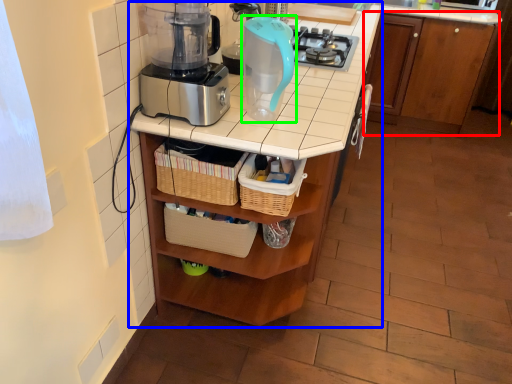
Question: Based on their relative distances, which object is nearer to cabinetry (highlighted by a red box)? Choose from table (highlighted by a blue box) and kitchen appliance (highlighted by a green box).

Choices:
 (A) table
 (B) kitchen appliance

Answer: (A)